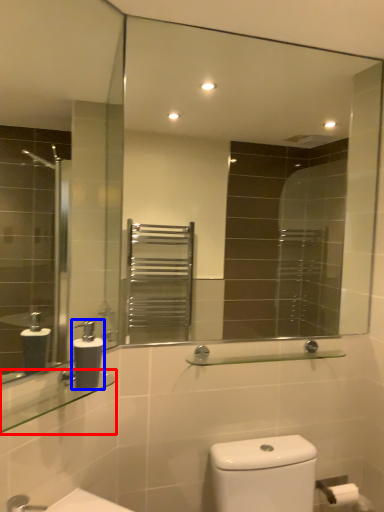
Question: Which object is closer to the camera taking this photo, balustrade (highlighted by a red box) or soap dispenser (highlighted by a blue box)?

Choices:
 (A) balustrade
 (B) soap dispenser

Answer: (A)